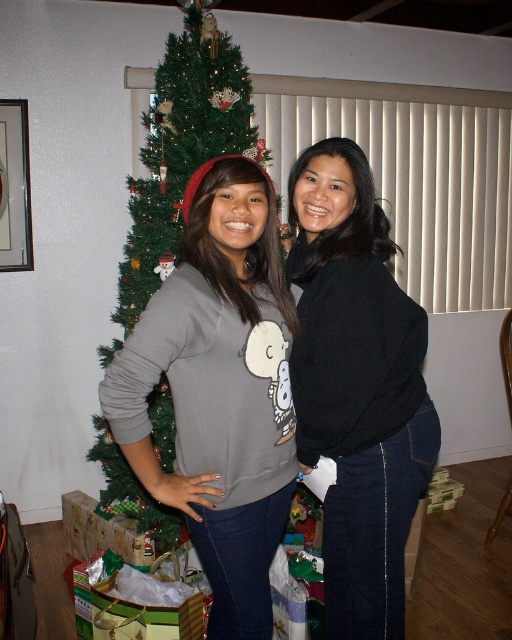
Which is more to the left, green textured christmas tree at center or green shiny wrapping paper at lower left?

green shiny wrapping paper at lower left is more to the left.

Who is more forward, (134, 269) or (99, 566)?

Positioned in front is point (99, 566).

What do you see at coordinates (181, 148) in the screenshot?
I see `green textured christmas tree at center` at bounding box center [181, 148].

What are the coordinates of `green textured christmas tree at center` in the screenshot? It's located at (181, 148).

Between black matte sweater at center and green shiny wrapping paper at lower left, which one has less height?

green shiny wrapping paper at lower left is shorter.

Is black matte sweater at center bigger than green shiny wrapping paper at lower left?

Correct, black matte sweater at center is larger in size than green shiny wrapping paper at lower left.

This screenshot has height=640, width=512. Describe the element at coordinates (357, 387) in the screenshot. I see `black matte sweater at center` at that location.

At what (x,y) coordinates should I click in order to perform the action: click on black matte sweater at center. Please return your answer as a coordinate pair (x, y). The height and width of the screenshot is (640, 512). Looking at the image, I should click on pyautogui.click(x=357, y=387).

Can you confirm if black matte sweater at center is positioned above green textured christmas tree at center?

No.

Is point (366, 344) positioned in front of point (187, 179)?

Yes.

Is point (415, 387) more distant than point (162, 237)?

No, (415, 387) is closer to viewer.

Where is `black matte sweater at center`? black matte sweater at center is located at coordinates (357, 387).